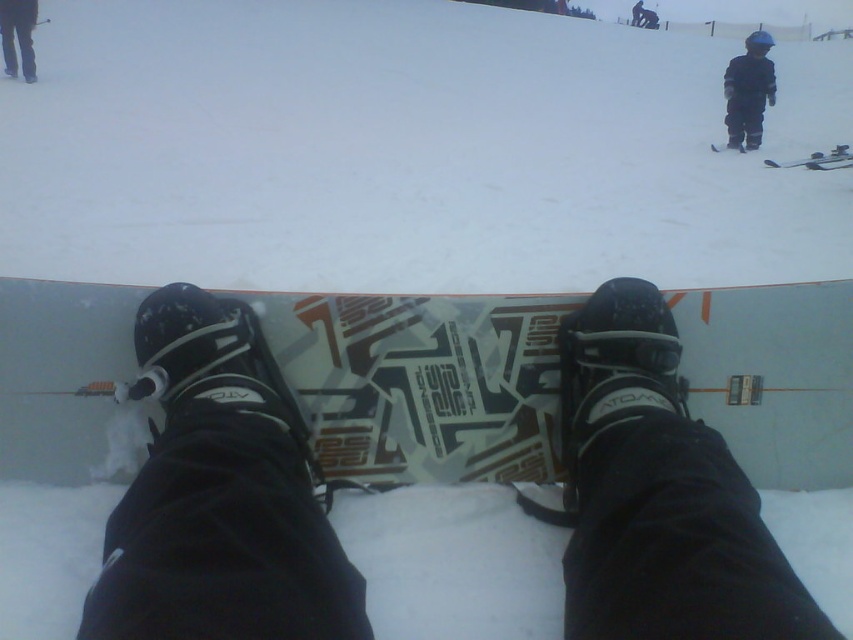
Is black matte snowsuit at upper right to the left of black fabric pants at upper left from the viewer's perspective?

No, black matte snowsuit at upper right is not to the left of black fabric pants at upper left.

Does point (756, 80) come closer to viewer compared to point (22, 33)?

Yes, it is in front of point (22, 33).

Is point (733, 138) in front of point (16, 38)?

Yes, it is.

Where is `black matte snowsuit at upper right`? black matte snowsuit at upper right is located at coordinates (747, 92).

Describe the element at coordinates (422, 381) in the screenshot. The height and width of the screenshot is (640, 853). I see `matte black snowboard at center` at that location.

Who is positioned more to the left, matte black snowboard at center or black matte snowsuit at upper right?

matte black snowboard at center is more to the left.

Identify the location of matte black snowboard at center. (422, 381).

The width and height of the screenshot is (853, 640). I want to click on matte black snowboard at center, so click(422, 381).

Measure the distance between point [790,340] and camera.

Point [790,340] and camera are 4.68 feet apart.

Can you confirm if matte black snowboard at center is shorter than black fabric pants at upper left?

Indeed, matte black snowboard at center has a lesser height compared to black fabric pants at upper left.

Is point (300, 380) farther from viewer compared to point (9, 76)?

No.

What are the coordinates of `matte black snowboard at center` in the screenshot? It's located at (422, 381).